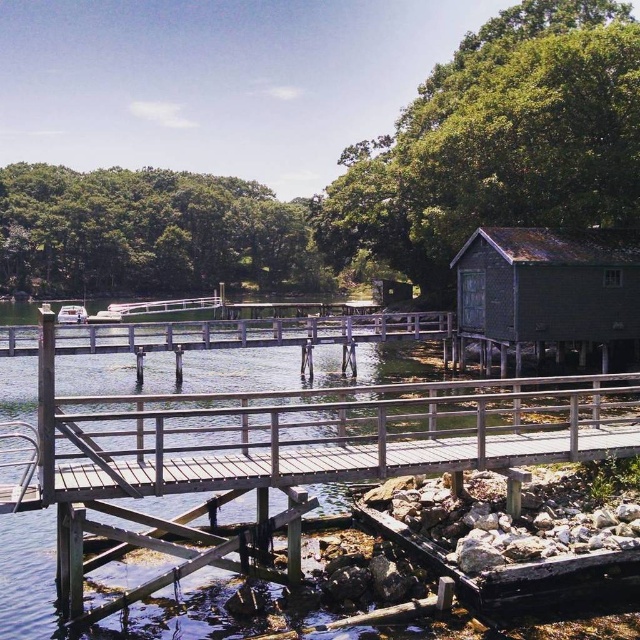
Question: Can you confirm if white plastic boat at center is bigger than white matte boat at center?

Choices:
 (A) yes
 (B) no

Answer: (A)

Question: Does white plastic boat at center appear over white matte boat at center?

Choices:
 (A) no
 (B) yes

Answer: (B)

Question: Which point is farther to the camera?

Choices:
 (A) white plastic boat at center
 (B) white matte boat at center

Answer: (A)

Question: Does white plastic boat at center have a smaller size compared to white matte boat at center?

Choices:
 (A) yes
 (B) no

Answer: (B)